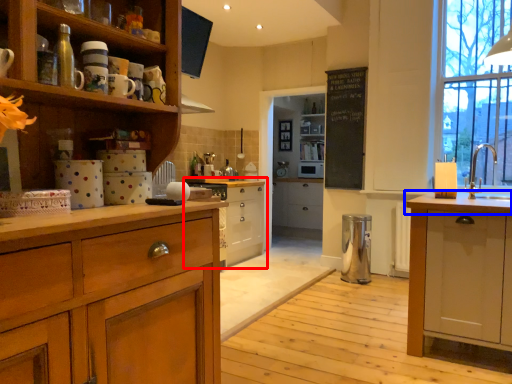
Question: Which object appears farthest to the camera in this image, cabinetry (highlighted by a red box) or countertop (highlighted by a blue box)?

Choices:
 (A) cabinetry
 (B) countertop

Answer: (A)